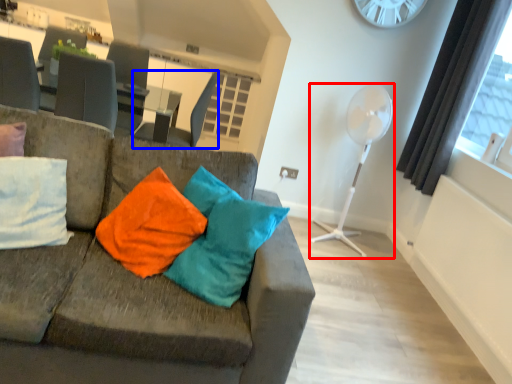
Question: Which of the following is the closest to the observer, fan (highlighted by a red box) or swivel chair (highlighted by a blue box)?

Choices:
 (A) fan
 (B) swivel chair

Answer: (A)